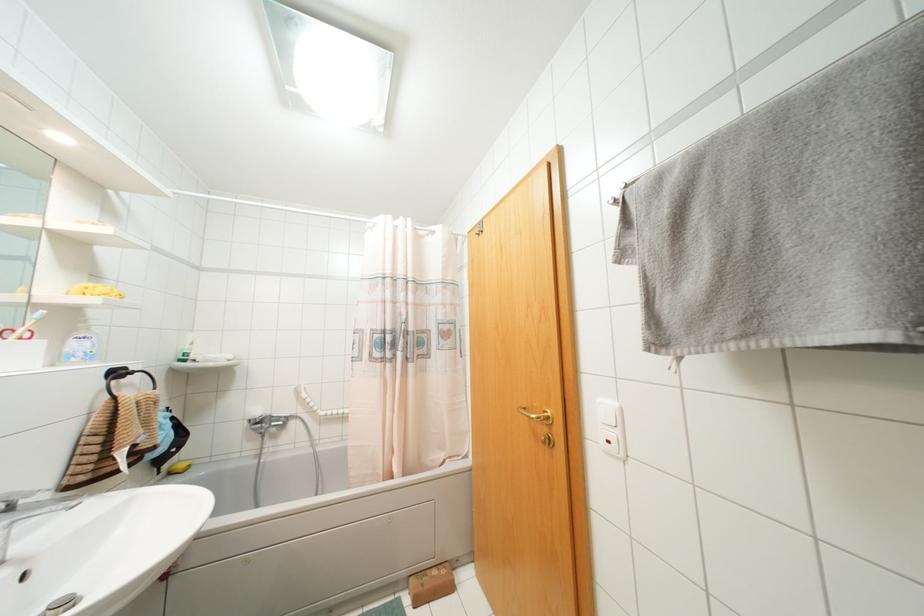
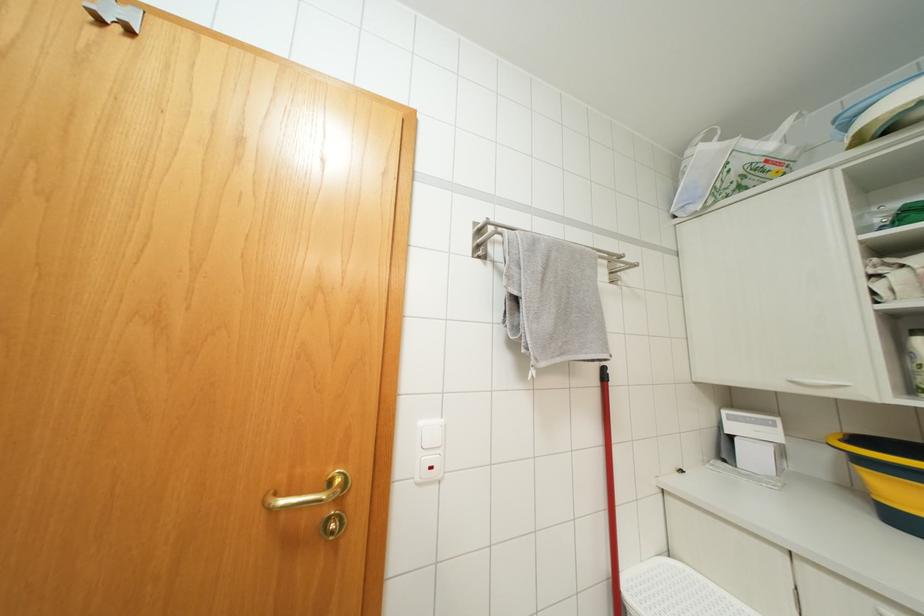
Question: How did the camera likely rotate?

Choices:
 (A) Left
 (B) Right
 (C) Up
 (D) Down

Answer: (B)